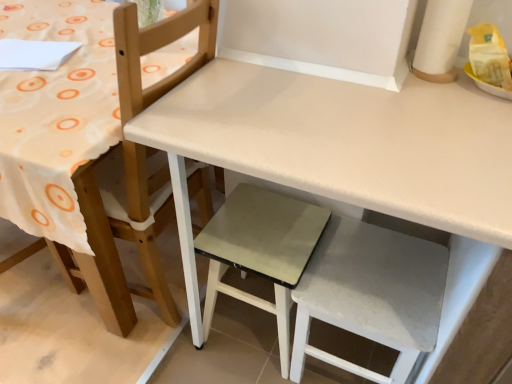
Where is `vacant area on top of white fabric step stool at lower right, the 1th step stool from the right (from a real-world perspective)`? The width and height of the screenshot is (512, 384). vacant area on top of white fabric step stool at lower right, the 1th step stool from the right (from a real-world perspective) is located at coordinates (374, 273).